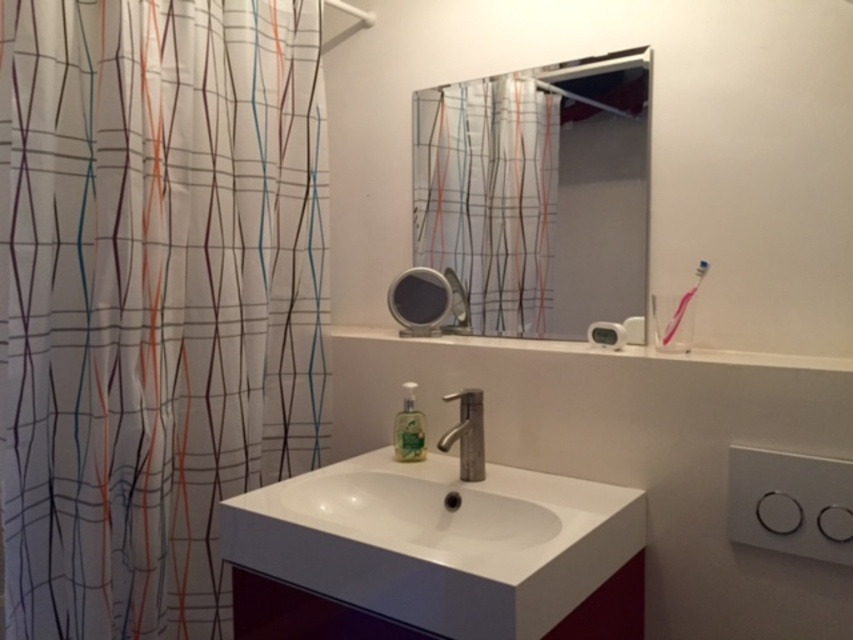
Question: Observing the image, what is the correct spatial positioning of clear glass mirror at upper center in reference to metallic faucet at center?

Choices:
 (A) below
 (B) above

Answer: (B)

Question: Which of the following is the closest to the observer?

Choices:
 (A) clear glass mirror at upper center
 (B) pink plastic toothbrush at upper right

Answer: (B)

Question: Observing the image, what is the correct spatial positioning of white glossy sink at center in reference to metallic faucet at center?

Choices:
 (A) above
 (B) below

Answer: (B)

Question: Does white glossy sink at center appear under pink plastic toothbrush at upper right?

Choices:
 (A) yes
 (B) no

Answer: (A)

Question: Among these objects, which one is farthest from the camera?

Choices:
 (A) translucent green liquid at sink
 (B) metallic faucet at center
 (C) silver metallic faucet at center

Answer: (B)

Question: Which of the following is the farthest from the observer?

Choices:
 (A) metallic faucet at center
 (B) transparent plastic shower curtain at left

Answer: (A)